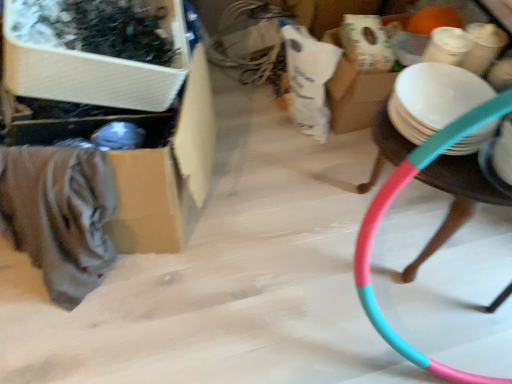
Question: Does pink plastic hoop at right contain white matte plate at right?

Choices:
 (A) no
 (B) yes

Answer: (A)

Question: Does pink plastic hoop at right have a larger size compared to white matte plate at right?

Choices:
 (A) no
 (B) yes

Answer: (B)

Question: From a real-world perspective, is pink plastic hoop at right over white matte plate at right?

Choices:
 (A) yes
 (B) no

Answer: (B)

Question: Is pink plastic hoop at right oriented towards white matte plate at right?

Choices:
 (A) no
 (B) yes

Answer: (A)

Question: From the image's perspective, is pink plastic hoop at right located above white matte plate at right?

Choices:
 (A) yes
 (B) no

Answer: (B)

Question: Looking at the image, does cardboard box at left, which appears as the second storage box when viewed from the front, seem bigger or smaller compared to wooden storage box at upper left, acting as the first storage box starting from the front?

Choices:
 (A) small
 (B) big

Answer: (B)

Question: From the image's perspective, is cardboard box at left, the first storage box in the back-to-front sequence, above or below wooden storage box at upper left, the second storage box in the back-to-front sequence?

Choices:
 (A) below
 (B) above

Answer: (A)

Question: Considering the positions of cardboard box at left, which appears as the second storage box when viewed from the front, and wooden storage box at upper left, the second storage box in the back-to-front sequence, in the image, is cardboard box at left, which appears as the second storage box when viewed from the front, wider or thinner than wooden storage box at upper left, the second storage box in the back-to-front sequence,?

Choices:
 (A) thin
 (B) wide

Answer: (B)

Question: From a real-world perspective, is cardboard box at left, which appears as the second storage box when viewed from the front, above or below wooden storage box at upper left, acting as the first storage box starting from the front?

Choices:
 (A) above
 (B) below

Answer: (B)

Question: Relative to pink plastic hoop at right, is white matte plate at right in front or behind?

Choices:
 (A) behind
 (B) front

Answer: (A)

Question: Based on their positions, is white matte plate at right located to the left or right of pink plastic hoop at right?

Choices:
 (A) left
 (B) right

Answer: (A)

Question: Considering the positions of white matte plate at right and pink plastic hoop at right in the image, is white matte plate at right wider or thinner than pink plastic hoop at right?

Choices:
 (A) wide
 (B) thin

Answer: (B)

Question: Is white matte plate at right spatially inside pink plastic hoop at right, or outside of it?

Choices:
 (A) outside
 (B) inside

Answer: (A)

Question: Is pink plastic hoop at right inside the boundaries of white matte plate at right, or outside?

Choices:
 (A) outside
 (B) inside

Answer: (A)

Question: Considering the relative positions of pink plastic hoop at right and white matte plate at right in the image provided, is pink plastic hoop at right to the left or to the right of white matte plate at right?

Choices:
 (A) left
 (B) right

Answer: (B)